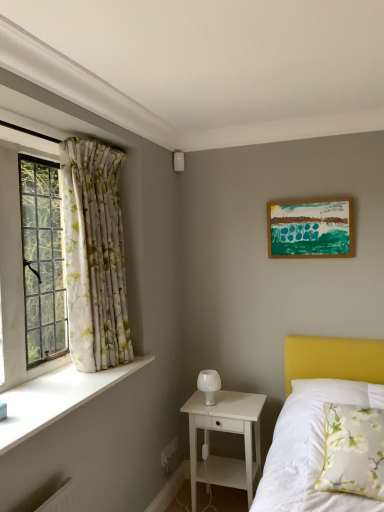
Image resolution: width=384 pixels, height=512 pixels. In order to click on white floral pillow at lower right in this screenshot , I will do `click(353, 450)`.

What do you see at coordinates (209, 385) in the screenshot?
I see `white frosted glass table lamp at center` at bounding box center [209, 385].

What do you see at coordinates (311, 228) in the screenshot? The width and height of the screenshot is (384, 512). I see `wooden picture frame at upper right` at bounding box center [311, 228].

At what (x,y) coordinates should I click in order to perform the action: click on white floral pillow at lower right. Please return your answer as a coordinate pair (x, y). Looking at the image, I should click on (353, 450).

How different are the orientations of floral fabric curtain at left and white floral pillow at lower right in degrees?

The angle between the facing direction of floral fabric curtain at left and the facing direction of white floral pillow at lower right is 92.8 degrees.

Can you confirm if floral fabric curtain at left is thinner than white floral pillow at lower right?

Yes.

From the picture: Measure the distance between floral fabric curtain at left and white floral pillow at lower right.

floral fabric curtain at left and white floral pillow at lower right are 1.36 meters apart from each other.

In the scene shown: Would you say floral fabric curtain at left is a long distance from white floral pillow at lower right?

Yes.

Who is shorter, white wood nightstand at lower center or white smooth window sill at left?

white smooth window sill at left is shorter.

Which is less distant, (232, 411) or (17, 394)?

Clearly, point (232, 411) is more distant from the camera than point (17, 394).

From the image's perspective, between white wood nightstand at lower center and white smooth window sill at left, who is located below?

white wood nightstand at lower center is shown below in the image.

Considering the relative sizes of white wood nightstand at lower center and white smooth window sill at left in the image provided, is white wood nightstand at lower center thinner than white smooth window sill at left?

In fact, white wood nightstand at lower center might be wider than white smooth window sill at left.

From the image's perspective, which one is positioned higher, clear glass window at left or floral fabric curtain at left?

clear glass window at left appears higher in the image.

Where is `window above the floral fabric curtain at left (from the image's perspective)`? window above the floral fabric curtain at left (from the image's perspective) is located at coordinates (42, 261).

Consider the image. Between clear glass window at left and floral fabric curtain at left, which one has larger size?

floral fabric curtain at left is bigger.

Does clear glass window at left have a lesser width compared to floral fabric curtain at left?

Correct, the width of clear glass window at left is less than that of floral fabric curtain at left.

Looking at the image, does floral fabric curtain at left seem bigger or smaller compared to wooden picture frame at upper right?

floral fabric curtain at left is bigger than wooden picture frame at upper right.

Who is shorter, floral fabric curtain at left or wooden picture frame at upper right?

With less height is wooden picture frame at upper right.

Is floral fabric curtain at left to the left of wooden picture frame at upper right from the viewer's perspective?

Correct, you'll find floral fabric curtain at left to the left of wooden picture frame at upper right.

In order to click on picture frame that is above the floral fabric curtain at left (from a real-world perspective) in this screenshot , I will do `click(311, 228)`.

Which is closer to the camera, (341,198) or (104,377)?

Clearly, point (341,198) is more distant from the camera than point (104,377).

Are wooden picture frame at upper right and white smooth window sill at left far apart?

wooden picture frame at upper right is positioned a significant distance from white smooth window sill at left.

From a real-world perspective, which is physically above, wooden picture frame at upper right or white smooth window sill at left?

wooden picture frame at upper right, from a real-world perspective.

Identify the location of window sill on the left of the wooden picture frame at upper right. (55, 398).

Find the location of `table lamp beneath the wooden picture frame at upper right (from a real-world perspective)`. table lamp beneath the wooden picture frame at upper right (from a real-world perspective) is located at coordinates (209, 385).

From a real-world perspective, is white frosted glass table lamp at center above or below wooden picture frame at upper right?

white frosted glass table lamp at center is situated lower than wooden picture frame at upper right in the real world.

Does white frosted glass table lamp at center have a greater height compared to wooden picture frame at upper right?

No, white frosted glass table lamp at center is not taller than wooden picture frame at upper right.

Is white frosted glass table lamp at center turned away from wooden picture frame at upper right?

white frosted glass table lamp at center is not turned away from wooden picture frame at upper right.

Between white frosted glass table lamp at center and white wood nightstand at lower center, which one has larger width?

white wood nightstand at lower center is wider.

From a real-world perspective, who is located higher, white frosted glass table lamp at center or white wood nightstand at lower center?

white frosted glass table lamp at center, from a real-world perspective.

Is white frosted glass table lamp at center touching white wood nightstand at lower center?

No, white frosted glass table lamp at center is not touching white wood nightstand at lower center.

Is white frosted glass table lamp at center oriented towards white wood nightstand at lower center?

No, white frosted glass table lamp at center is not turned towards white wood nightstand at lower center.

What are the coordinates of `curtain that is above the white floral pillow at lower right (from a real-world perspective)` in the screenshot? It's located at [94, 255].

This screenshot has height=512, width=384. What are the coordinates of `nightstand located below the white smooth window sill at left (from the image's perspective)` in the screenshot? It's located at 225,431.

Which object lies nearer to the anchor point white smooth window sill at left, white floral pillow at lower right or clear glass window at left?

The object closer to white smooth window sill at left is clear glass window at left.

Based on their spatial positions, is clear glass window at left or white floral pillow at lower right closer to white smooth window sill at left?

clear glass window at left lies closer to white smooth window sill at left than the other object.

Estimate the real-world distances between objects in this image. Which object is closer to wooden picture frame at upper right, white frosted glass table lamp at center or clear glass window at left?

white frosted glass table lamp at center lies closer to wooden picture frame at upper right than the other object.

Estimate the real-world distances between objects in this image. Which object is closer to white wood nightstand at lower center, floral fabric curtain at left or white smooth window sill at left?

Based on the image, white smooth window sill at left appears to be nearer to white wood nightstand at lower center.

Based on their spatial positions, is wooden picture frame at upper right or white smooth window sill at left closer to white wood nightstand at lower center?

white smooth window sill at left.

Based on their spatial positions, is floral fabric curtain at left or white frosted glass table lamp at center closer to clear glass window at left?

Based on the image, floral fabric curtain at left appears to be nearer to clear glass window at left.

Considering their positions, is wooden picture frame at upper right positioned closer to clear glass window at left than white wood nightstand at lower center?

Based on the image, white wood nightstand at lower center appears to be nearer to clear glass window at left.

Considering their positions, is clear glass window at left positioned closer to white wood nightstand at lower center than white frosted glass table lamp at center?

white frosted glass table lamp at center is closer to white wood nightstand at lower center.

Identify the location of curtain situated between clear glass window at left and wooden picture frame at upper right from left to right. Image resolution: width=384 pixels, height=512 pixels. (94, 255).

The width and height of the screenshot is (384, 512). Find the location of `table lamp that lies between wooden picture frame at upper right and white floral pillow at lower right from top to bottom`. table lamp that lies between wooden picture frame at upper right and white floral pillow at lower right from top to bottom is located at coordinates (209, 385).

This screenshot has width=384, height=512. What are the coordinates of `curtain situated between white smooth window sill at left and white floral pillow at lower right from left to right` in the screenshot? It's located at (94, 255).

At what (x,y) coordinates should I click in order to perform the action: click on window sill that lies between wooden picture frame at upper right and white wood nightstand at lower center from top to bottom. Please return your answer as a coordinate pair (x, y). The image size is (384, 512). Looking at the image, I should click on (55, 398).